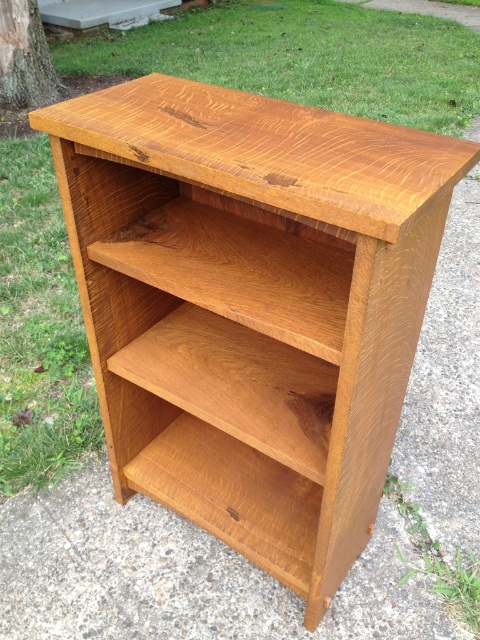
Is point (312, 396) farther from camera compared to point (277, 534)?

No.

Who is more forward, (325, 452) or (205, 512)?

Point (325, 452) is more forward.

Who is more distant from viewer, [189,387] or [200,499]?

The point [200,499] is more distant.

You are a GUI agent. You are given a task and a screenshot of the screen. Output one action in this format:
    pyautogui.click(x=<x>, y=<y>)
    Task: Click on the light brown wood at center
    The image size is (480, 640).
    Given the screenshot: What is the action you would take?
    pyautogui.click(x=238, y=384)